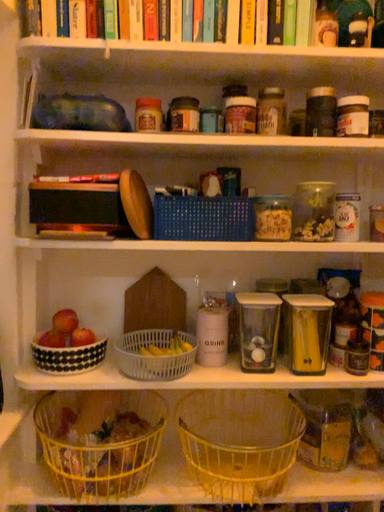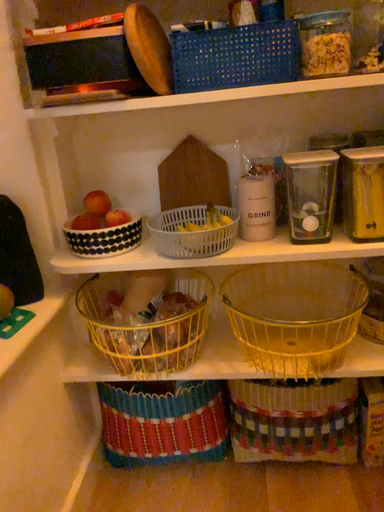
Question: Which way did the camera rotate in the video?

Choices:
 (A) rotated upward
 (B) rotated downward

Answer: (B)